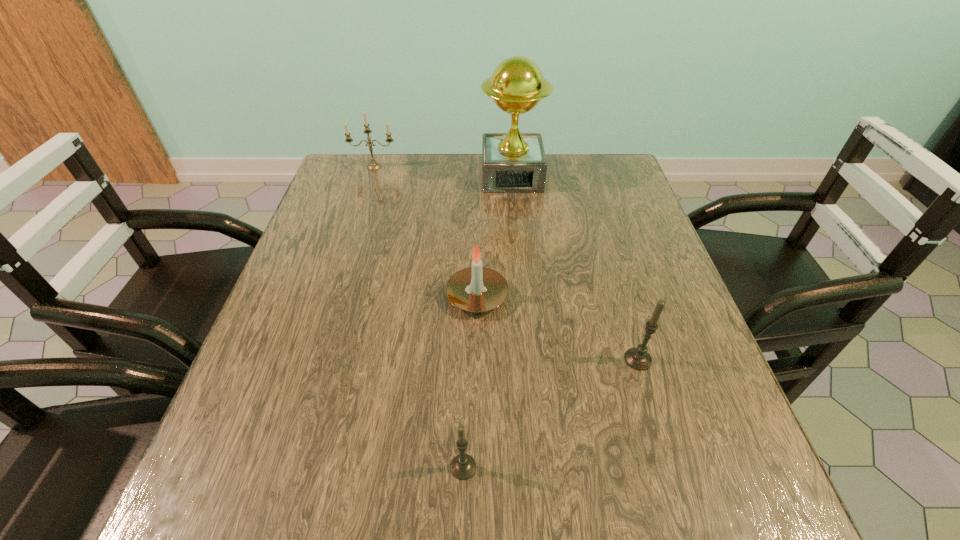
Image resolution: width=960 pixels, height=540 pixels. Identify the location of blank space located on the back of the third farthest object. (478, 232).

You are a GUI agent. You are given a task and a screenshot of the screen. Output one action in this format:
    pyautogui.click(x=<x>, y=<y>)
    Task: Click on the vacant space located 0.360m on the right of the nearest candle
    
    Given the screenshot: What is the action you would take?
    pyautogui.click(x=710, y=467)

You are a GUI agent. You are given a task and a screenshot of the screen. Output one action in this format:
    pyautogui.click(x=<x>, y=<y>)
    Task: Click on the award that is at the far edge
    The width and height of the screenshot is (960, 540).
    Given the screenshot: What is the action you would take?
    pyautogui.click(x=513, y=162)

You are a GUI agent. You are given a task and a screenshot of the screen. Output one action in this format:
    pyautogui.click(x=<x>, y=<y>)
    Task: Click on the candle positioned at the far edge
    Image resolution: width=960 pixels, height=540 pixels.
    Given the screenshot: What is the action you would take?
    pyautogui.click(x=373, y=166)

Locate an element on the screen. The image size is (960, 540). object present at the near edge is located at coordinates (463, 466).

The image size is (960, 540). I want to click on object that is positioned at the left edge, so click(x=373, y=166).

Locate an element on the screen. object at the right edge is located at coordinates (638, 358).

Identify the location of object located at the far left corner. The height and width of the screenshot is (540, 960). (373, 166).

The height and width of the screenshot is (540, 960). What are the coordinates of `vacant space at the far edge of the desktop` in the screenshot? It's located at (461, 157).

The height and width of the screenshot is (540, 960). I want to click on blank area at the near edge, so [542, 503].